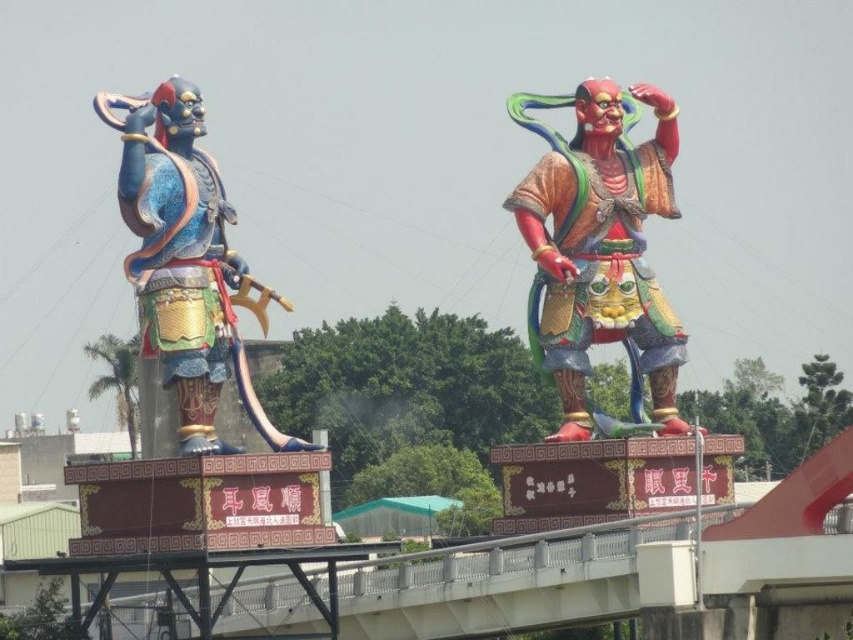
Who is positioned more to the right, glossy painted statue at right or shiny blue armor at left?

glossy painted statue at right is more to the right.

Is point (657, 300) behind point (109, 116)?

Yes, point (657, 300) is behind point (109, 116).

Which is behind, point (689, 429) or point (207, 436)?

Positioned behind is point (689, 429).

Where is `glossy painted statue at right`? This screenshot has width=853, height=640. glossy painted statue at right is located at coordinates (601, 248).